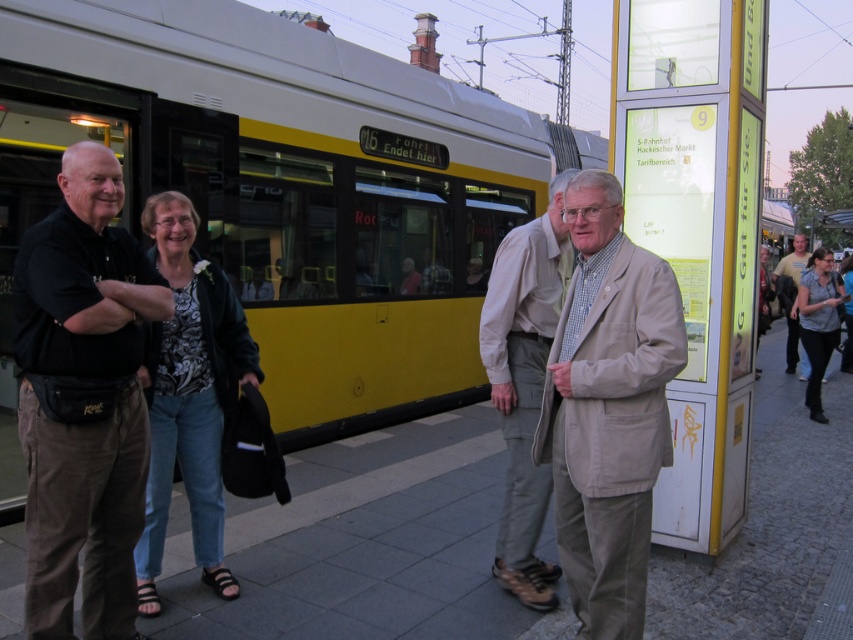
Consider the image. You are standing at the tram stop and want to walk towards the tram. There are two points marked on the ground, point A at coordinates point (639,573) and point B at coordinates point (790,336). Which point should you step on first if you want to approach the tram?

Point A at coordinates point (639,573) is in front of point B at coordinates point (790,336), so you should step on point A first to approach the tram.

Based on the coordinates provided, which object is located at point (83,401)?

The point (83,401) marks the location of the black cotton shirt at left.